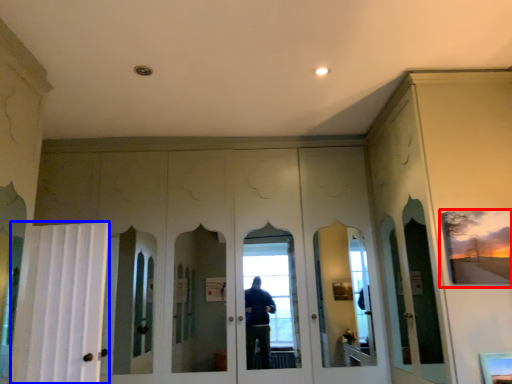
Question: Which object appears farthest to the camera in this image, picture frame (highlighted by a red box) or curtain (highlighted by a blue box)?

Choices:
 (A) picture frame
 (B) curtain

Answer: (B)